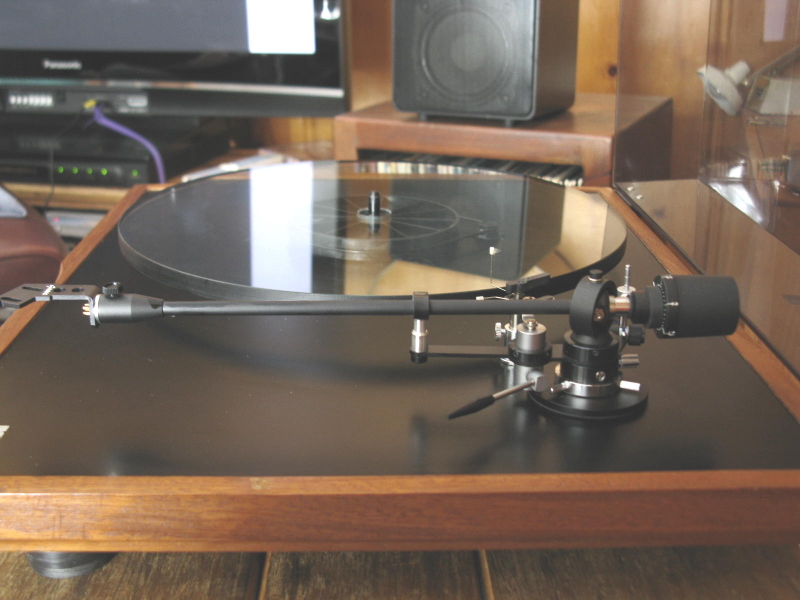
Where is `knot in wood`? This screenshot has width=800, height=600. knot in wood is located at coordinates (616, 73).